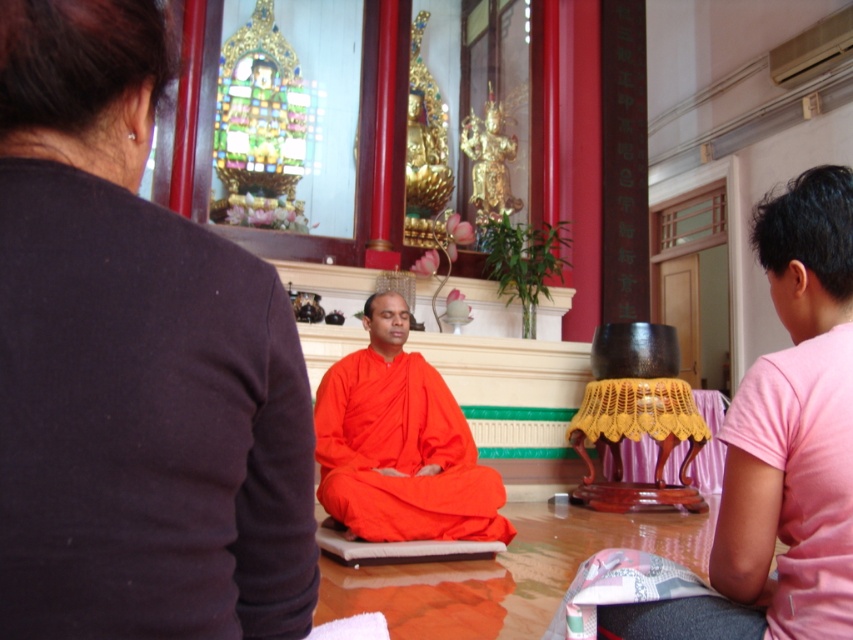
In order to click on dark brown fabric at upper left in this screenshot , I will do `click(134, 364)`.

Between dark brown fabric at upper left and orange cloth at center, which one has more height?

With more height is orange cloth at center.

Image resolution: width=853 pixels, height=640 pixels. In order to click on dark brown fabric at upper left in this screenshot , I will do `click(134, 364)`.

Where is `dark brown fabric at upper left`? The image size is (853, 640). dark brown fabric at upper left is located at coordinates (134, 364).

Is dark brown fabric at upper left bigger than orange silk dhoti at center?

Incorrect, dark brown fabric at upper left is not larger than orange silk dhoti at center.

What do you see at coordinates (134, 364) in the screenshot?
I see `dark brown fabric at upper left` at bounding box center [134, 364].

Locate an element on the screen. This screenshot has width=853, height=640. dark brown fabric at upper left is located at coordinates (134, 364).

Between orange cloth at center and orange silk dhoti at center, which one has less height?

orange cloth at center

Which is in front, point (770, 429) or point (444, 531)?

Point (770, 429)

Where is `orange cloth at center`? This screenshot has height=640, width=853. orange cloth at center is located at coordinates (782, 445).